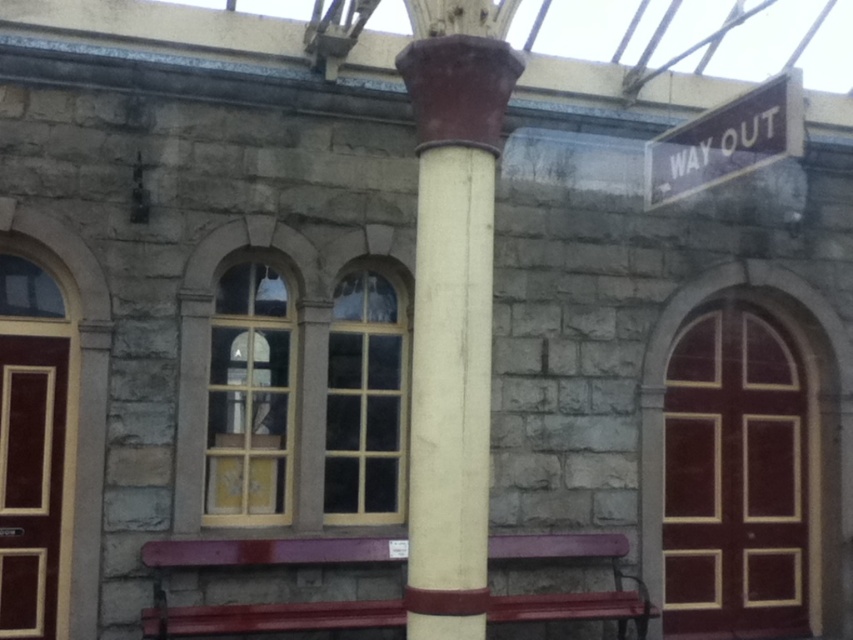
Is white glossy column at center thinner than maroon painted wood bench at center?

Indeed, white glossy column at center has a lesser width compared to maroon painted wood bench at center.

Which is above, white glossy column at center or maroon painted wood bench at center?

white glossy column at center

Locate an element on the screen. Image resolution: width=853 pixels, height=640 pixels. white glossy column at center is located at coordinates (451, 324).

The width and height of the screenshot is (853, 640). Describe the element at coordinates (451, 324) in the screenshot. I see `white glossy column at center` at that location.

Identify the location of white glossy column at center. (451, 324).

Is maroon painted wood bench at center shorter than brown wooden sign at upper right?

Correct, maroon painted wood bench at center is not as tall as brown wooden sign at upper right.

Is point (370, 541) positioned behind point (695, 156)?

Yes, it is behind point (695, 156).

What do you see at coordinates (268, 604) in the screenshot? This screenshot has height=640, width=853. I see `maroon painted wood bench at center` at bounding box center [268, 604].

The height and width of the screenshot is (640, 853). In order to click on maroon painted wood bench at center in this screenshot , I will do `click(268, 604)`.